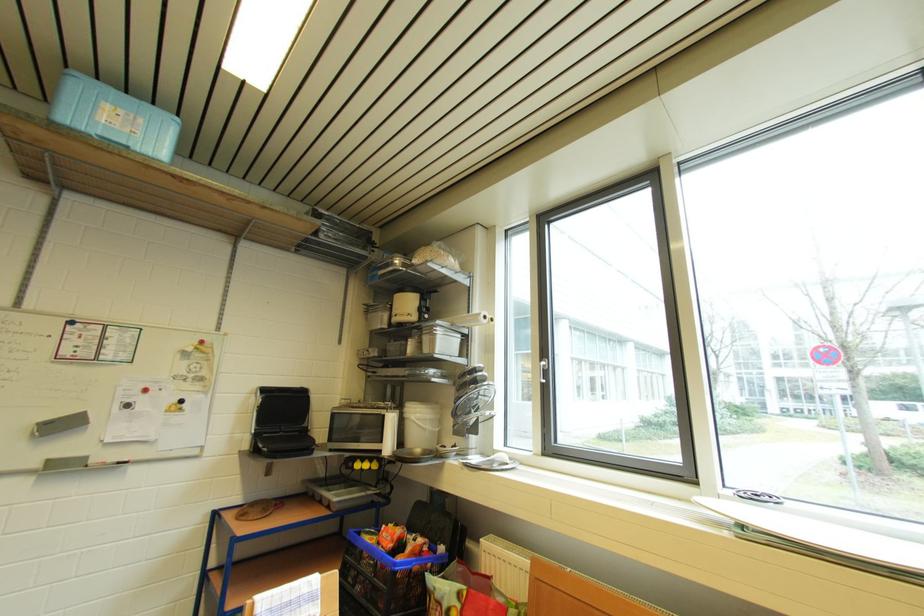
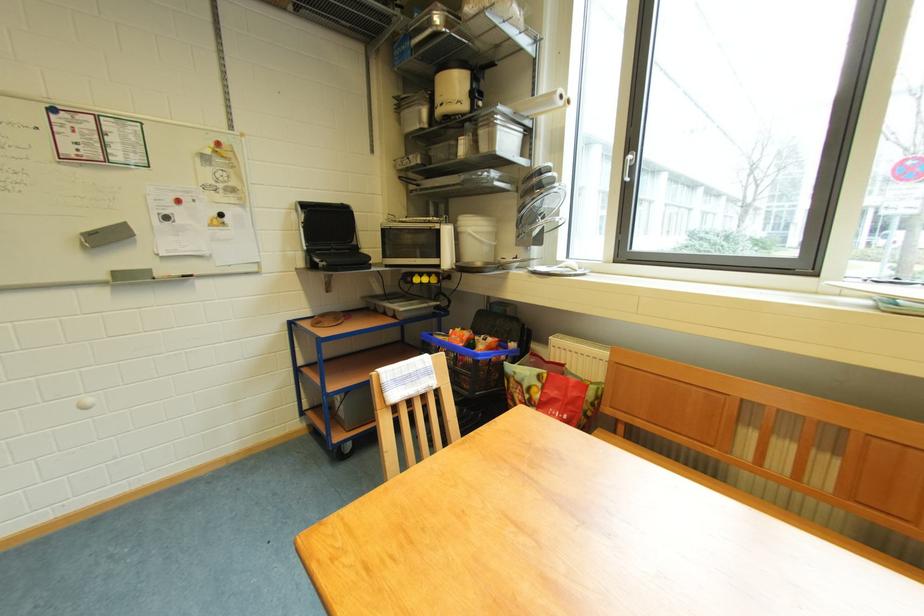
Find the pixel in the second image that matches the point at 423,422 in the first image.

(481, 235)